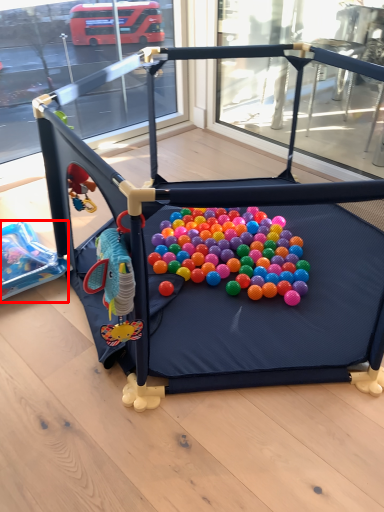
Question: From the image's perspective, what is the correct spatial relationship of toy (annotated by the red box) in relation to toy?

Choices:
 (A) below
 (B) above

Answer: (A)